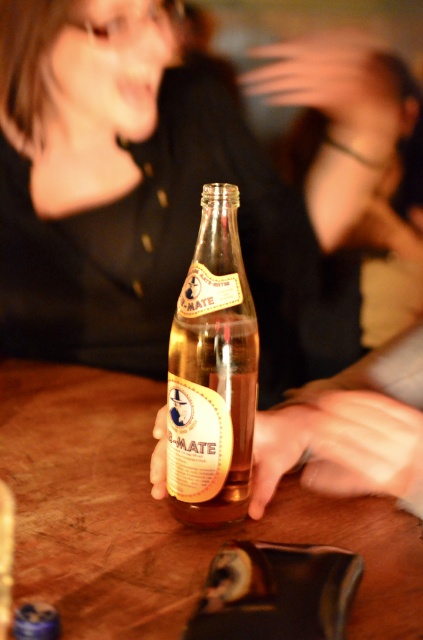
Question: Which object appears farthest from the camera in this image?

Choices:
 (A) translucent glass bottle at center
 (B) wooden table at center

Answer: (A)

Question: Considering the relative positions of matte glass bottle at center and translucent glass bottle at center in the image provided, where is matte glass bottle at center located with respect to translucent glass bottle at center?

Choices:
 (A) right
 (B) left

Answer: (B)

Question: Which of these objects is positioned closest to the translucent glass bottle at center?

Choices:
 (A) wooden table at center
 (B) matte glass bottle at center

Answer: (A)

Question: Is matte glass bottle at center to the left of translucent glass bottle at center from the viewer's perspective?

Choices:
 (A) no
 (B) yes

Answer: (B)

Question: Which point is farther to the camera?

Choices:
 (A) wooden table at center
 (B) matte glass bottle at center
 (C) translucent glass bottle at center

Answer: (B)

Question: Does matte glass bottle at center lie in front of translucent glass bottle at center?

Choices:
 (A) yes
 (B) no

Answer: (B)